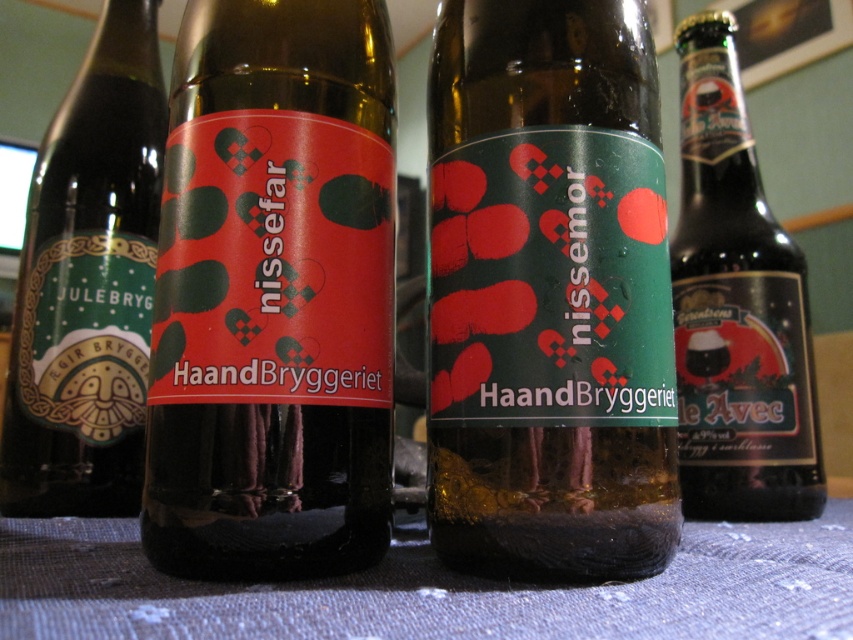
You are at a party and need to pass a plate between the matte glass bottle at center and the green matte bottle at left. The plate is 30 centimeters wide. Can you fit it between them without touching either bottle?

The matte glass bottle at center is 36.48 centimeters away from the green matte bottle at left. Since the plate is 30 centimeters wide, there is enough space between them to fit the plate without touching either bottle.

You are at a party and want to hand a bottle to a friend who is standing 3 feet away from you. You have a green matte bottle at left and a red glossy bottle at right. Which bottle can you reach without moving your hand?

The green matte bottle at left is closer to you since they are 32.61 inches apart, which is approximately 2.72 feet. Since your friend is 3 feet away, you can reach the green matte bottle at left without moving your hand, but the red glossy bottle at right is slightly out of reach.